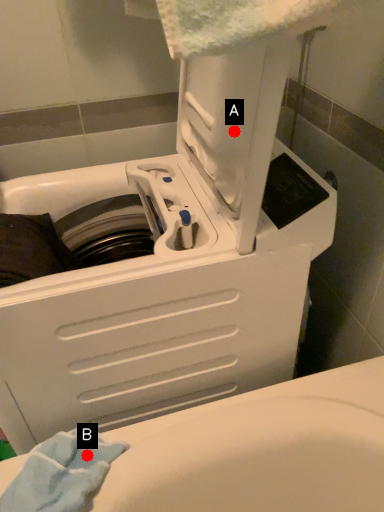
Question: Two points are circled on the image, labeled by A and B beside each circle. Among these points, which one is farthest from the camera?

Choices:
 (A) A is further
 (B) B is further

Answer: (B)